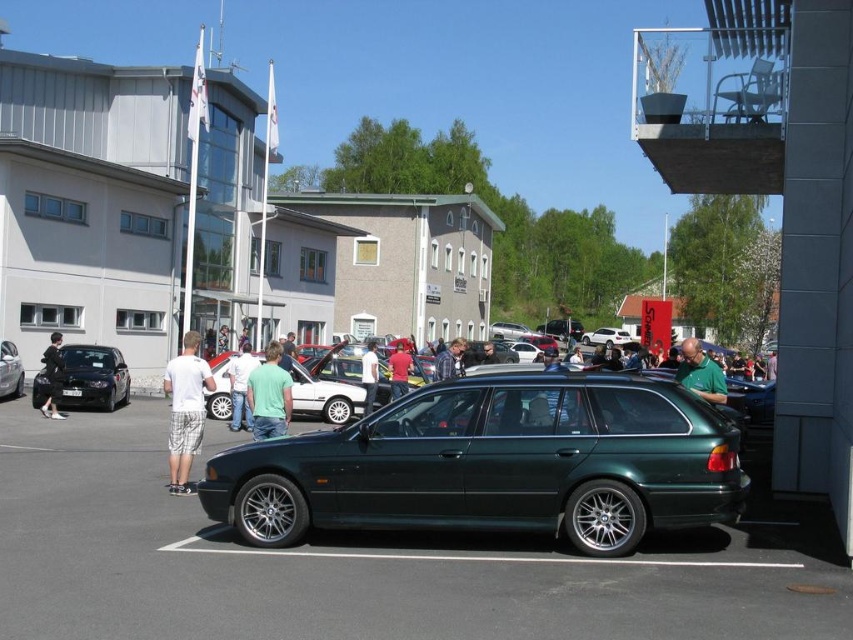
Which is below, green metallic car at center or white cotton shirt at center?

green metallic car at center is below.

Who is more distant from viewer, (25,627) or (207,381)?

The point (207,381) is behind.

Locate an element on the screen. This screenshot has height=640, width=853. green metallic car at center is located at coordinates (361, 564).

Which of these two, green cotton shirt at center or green matte car at center, stands taller?

green matte car at center

Does point (270, 342) lie behind point (363, 360)?

Yes, point (270, 342) is behind point (363, 360).

Who is more distant from viewer, (271, 404) or (368, 372)?

Point (368, 372)

Identify the location of green cotton shirt at center. The height and width of the screenshot is (640, 853). (270, 396).

Does dark green fabric jacket at center appear over matte black car at center?

Indeed, dark green fabric jacket at center is positioned over matte black car at center.

Who is taller, dark green fabric jacket at center or matte black car at center?

Standing taller between the two is dark green fabric jacket at center.

At what (x,y) coordinates should I click in order to perform the action: click on dark green fabric jacket at center. Please return your answer as a coordinate pair (x, y). This screenshot has width=853, height=640. Looking at the image, I should click on (53, 376).